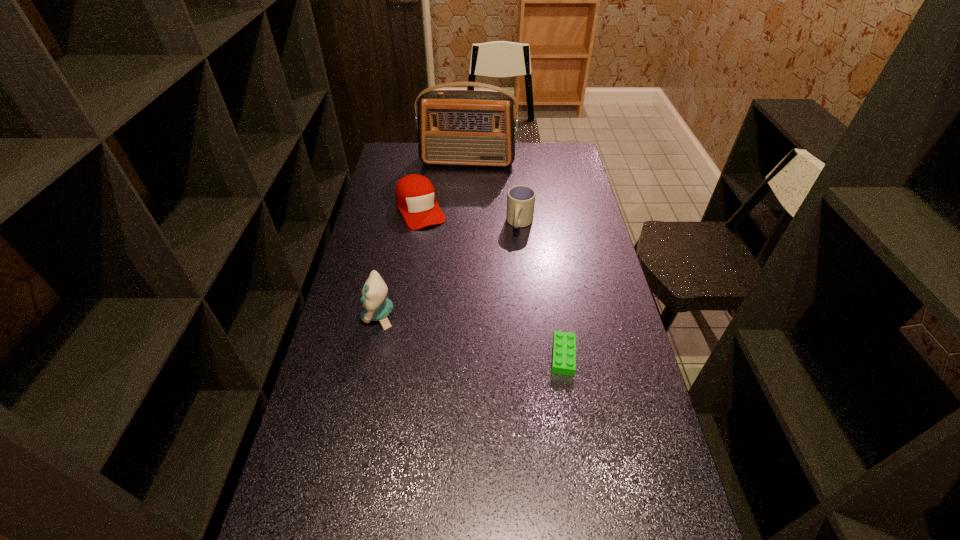
You are a GUI agent. You are given a task and a screenshot of the screen. Output one action in this format:
    pyautogui.click(x=<x>, y=<y>)
    Task: Click on the fourth farthest object
    This screenshot has width=960, height=540.
    Given the screenshot: What is the action you would take?
    pyautogui.click(x=377, y=307)

Identify the location of the second tallest object. (377, 307).

This screenshot has height=540, width=960. I want to click on the shortest object, so click(x=564, y=344).

Image resolution: width=960 pixels, height=540 pixels. I want to click on Lego, so click(564, 344).

The width and height of the screenshot is (960, 540). Identify the location of baseball cap. (415, 196).

This screenshot has height=540, width=960. In order to click on the tallest object in this screenshot , I will do point(455,127).

The height and width of the screenshot is (540, 960). I want to click on the farthest object, so pyautogui.click(x=455, y=127).

Identify the location of cup. (520, 199).

Find the location of a particular element. vacant area situated 0.080m on the face of the kitten is located at coordinates (337, 315).

Locate an element on the screen. This screenshot has height=540, width=960. free region located on the back of the Lego is located at coordinates (553, 294).